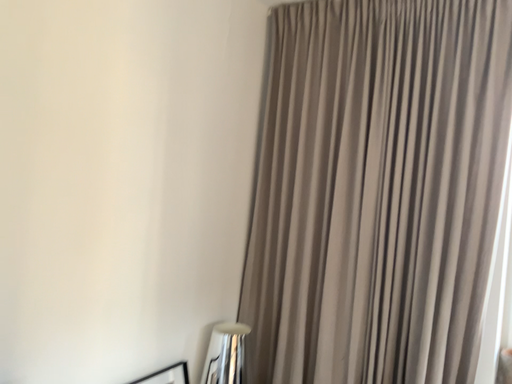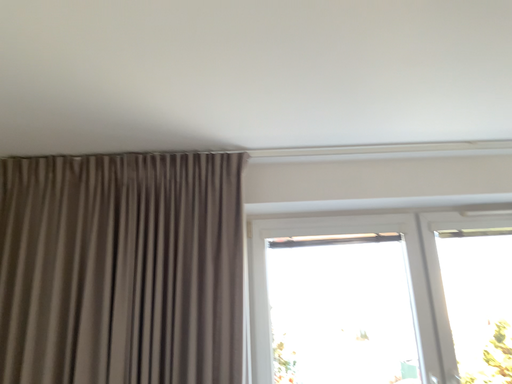
Question: Which way did the camera rotate in the video?

Choices:
 (A) rotated downward
 (B) rotated upward

Answer: (B)